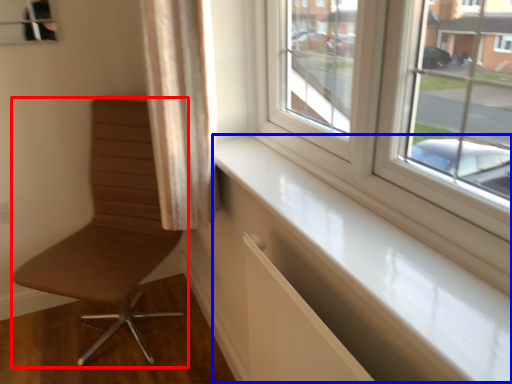
Question: Among these objects, which one is nearest to the camera, chair (highlighted by a red box) or window sill (highlighted by a blue box)?

Choices:
 (A) chair
 (B) window sill

Answer: (B)